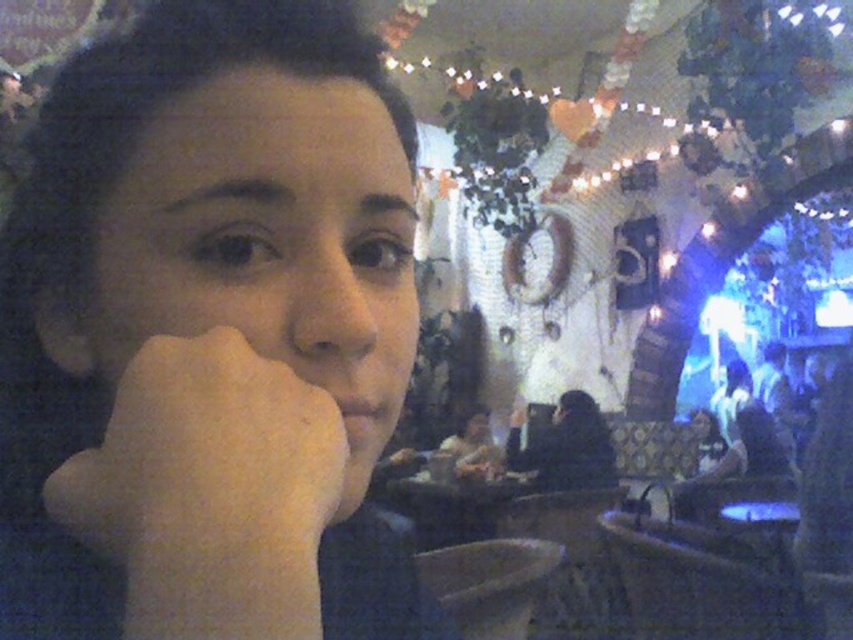
Which of these two, white matte hand at lower left or matte black hair at center, stands shorter?

Standing shorter between the two is white matte hand at lower left.

The height and width of the screenshot is (640, 853). What do you see at coordinates (209, 492) in the screenshot?
I see `white matte hand at lower left` at bounding box center [209, 492].

Which is behind, point (112, 474) or point (483, 424)?

Positioned behind is point (483, 424).

Locate an element on the screen. white matte hand at lower left is located at coordinates (209, 492).

Can you confirm if smooth skin nose at center is wider than black matte jacket at center?

No, smooth skin nose at center is not wider than black matte jacket at center.

Between smooth skin nose at center and black matte jacket at center, which one has more height?

With more height is black matte jacket at center.

Between point (323, 268) and point (572, 460), which one is positioned in front?

Point (323, 268) is in front.

Identify the location of smooth skin nose at center. The image size is (853, 640). (335, 300).

How distant is smooth skin at center from white matte hand at lower left?

smooth skin at center and white matte hand at lower left are 3.93 inches apart.

Does smooth skin at center have a greater height compared to white matte hand at lower left?

Yes, smooth skin at center is taller than white matte hand at lower left.

You are a GUI agent. You are given a task and a screenshot of the screen. Output one action in this format:
    pyautogui.click(x=<x>, y=<y>)
    Task: Click on the smooth skin at center
    The image size is (853, 640).
    Given the screenshot: What is the action you would take?
    pyautogui.click(x=204, y=337)

You are a GUI agent. You are given a task and a screenshot of the screen. Output one action in this format:
    pyautogui.click(x=<x>, y=<y>)
    Task: Click on the smooth skin at center
    The width and height of the screenshot is (853, 640).
    Given the screenshot: What is the action you would take?
    pyautogui.click(x=204, y=337)